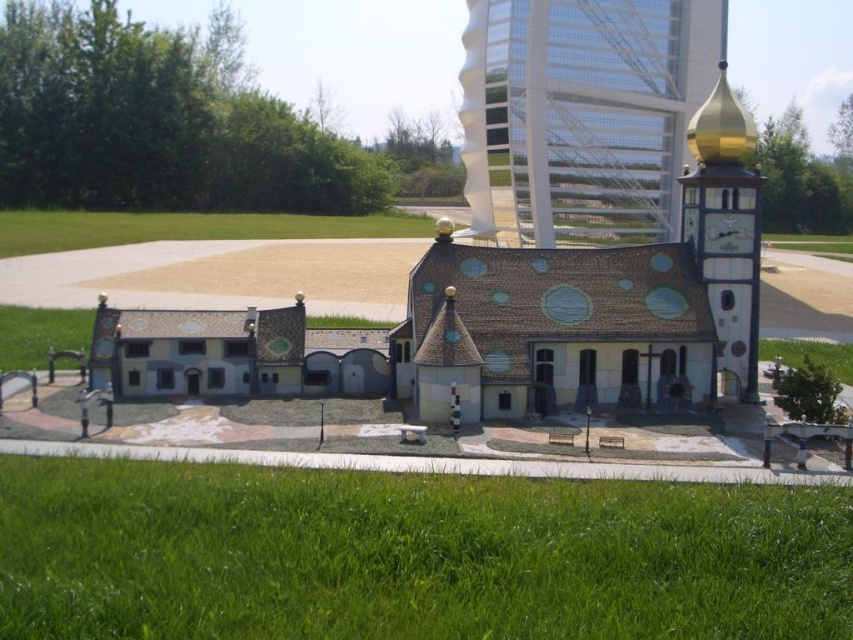
Which of these two, matte gold dome at upper center or gold metallic clock tower at upper right, stands shorter?

Standing shorter between the two is matte gold dome at upper center.

Does matte gold dome at upper center have a lesser width compared to gold metallic clock tower at upper right?

In fact, matte gold dome at upper center might be wider than gold metallic clock tower at upper right.

Is point (718, 36) more distant than point (715, 115)?

Yes, it is behind point (715, 115).

Identify the location of matte gold dome at upper center. (582, 115).